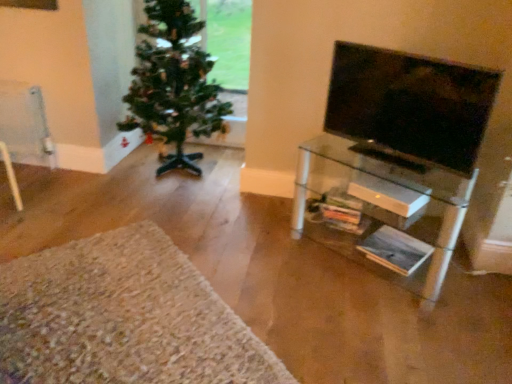
Question: Could you tell me if clear glass shelf at right is turned towards green matte christmas tree at left?

Choices:
 (A) no
 (B) yes

Answer: (A)

Question: Is the position of clear glass shelf at right more distant than that of green matte christmas tree at left?

Choices:
 (A) no
 (B) yes

Answer: (A)

Question: Is clear glass shelf at right at the left side of green matte christmas tree at left?

Choices:
 (A) no
 (B) yes

Answer: (A)

Question: From a real-world perspective, is clear glass shelf at right over green matte christmas tree at left?

Choices:
 (A) yes
 (B) no

Answer: (B)

Question: Is the surface of clear glass shelf at right in direct contact with green matte christmas tree at left?

Choices:
 (A) no
 (B) yes

Answer: (A)

Question: From the image's perspective, is black glossy tv at right located above or below green matte christmas tree at left?

Choices:
 (A) above
 (B) below

Answer: (B)

Question: Is black glossy tv at right situated inside green matte christmas tree at left or outside?

Choices:
 (A) outside
 (B) inside

Answer: (A)

Question: Is black glossy tv at right to the left or to the right of green matte christmas tree at left in the image?

Choices:
 (A) left
 (B) right

Answer: (B)

Question: From their relative heights in the image, would you say black glossy tv at right is taller or shorter than green matte christmas tree at left?

Choices:
 (A) short
 (B) tall

Answer: (A)

Question: From a real-world perspective, is black glossy tv at right physically located above or below clear glass shelf at right?

Choices:
 (A) above
 (B) below

Answer: (A)

Question: From the image's perspective, is black glossy tv at right above or below clear glass shelf at right?

Choices:
 (A) below
 (B) above

Answer: (B)

Question: From their relative heights in the image, would you say black glossy tv at right is taller or shorter than clear glass shelf at right?

Choices:
 (A) tall
 (B) short

Answer: (B)

Question: Is black glossy tv at right wider or thinner than clear glass shelf at right?

Choices:
 (A) thin
 (B) wide

Answer: (A)

Question: Is white shaggy rug at lower left inside the boundaries of black glossy tv at right, or outside?

Choices:
 (A) inside
 (B) outside

Answer: (B)

Question: Is white shaggy rug at lower left to the left or to the right of black glossy tv at right in the image?

Choices:
 (A) right
 (B) left

Answer: (B)